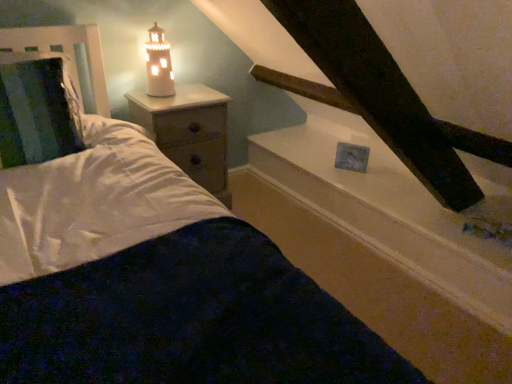
Identify the location of free point above white glossy window sill at upper center (from a real-world perspective). (378, 179).